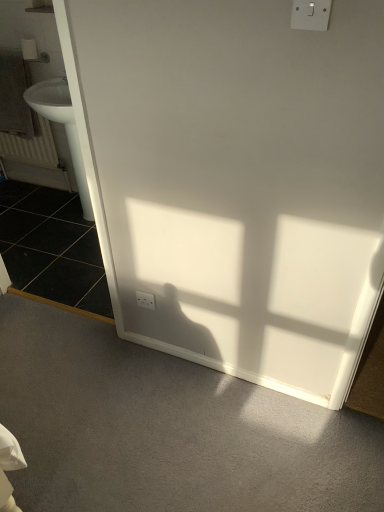
Question: Are gray textured towel at left and black tile at left located far from each other?

Choices:
 (A) no
 (B) yes

Answer: (A)

Question: Is the position of gray textured towel at left less distant than that of black tile at left?

Choices:
 (A) no
 (B) yes

Answer: (A)

Question: Is gray textured towel at left thinner than black tile at left?

Choices:
 (A) yes
 (B) no

Answer: (A)

Question: Is gray textured towel at left positioned behind black tile at left?

Choices:
 (A) yes
 (B) no

Answer: (A)

Question: From the image's perspective, would you say gray textured towel at left is shown under black tile at left?

Choices:
 (A) yes
 (B) no

Answer: (B)

Question: Considering the relative sizes of gray textured towel at left and black tile at left in the image provided, is gray textured towel at left bigger than black tile at left?

Choices:
 (A) no
 (B) yes

Answer: (A)

Question: Is gray textured towel at left completely or partially outside of white plastic electric outlet at lower left, which is the 1th electric outlet from back to front?

Choices:
 (A) no
 (B) yes

Answer: (B)

Question: Is gray textured towel at left surrounding white plastic electric outlet at lower left, which is the 1th electric outlet from back to front?

Choices:
 (A) yes
 (B) no

Answer: (B)

Question: Is gray textured towel at left far away from white plastic electric outlet at lower left, which is the 1th electric outlet from back to front?

Choices:
 (A) no
 (B) yes

Answer: (B)

Question: Is gray textured towel at left positioned with its back to white plastic electric outlet at lower left, acting as the 2th electric outlet starting from the front?

Choices:
 (A) no
 (B) yes

Answer: (A)

Question: Does gray textured towel at left lie in front of white plastic electric outlet at lower left, acting as the 2th electric outlet starting from the front?

Choices:
 (A) no
 (B) yes

Answer: (A)

Question: From a real-world perspective, is gray textured towel at left over white plastic electric outlet at lower left, the second electric outlet when ordered from top to bottom?

Choices:
 (A) yes
 (B) no

Answer: (A)

Question: From a real-world perspective, is white matte toilet paper at upper left positioned over white plastic electric outlet at lower left, the first electric outlet from the left, based on gravity?

Choices:
 (A) no
 (B) yes

Answer: (B)